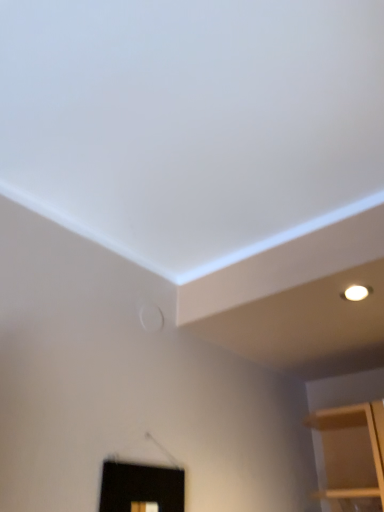
What do you see at coordinates (141, 488) in the screenshot?
I see `black matte cabinet at lower left` at bounding box center [141, 488].

In order to face black matte cabinet at lower left, should I rotate leftwards or rightwards?

Rotate your view left by about 7.078°.

Where is `black matte cabinet at lower left`? black matte cabinet at lower left is located at coordinates (141, 488).

Where is `black matte cabinet at lower left`? Image resolution: width=384 pixels, height=512 pixels. black matte cabinet at lower left is located at coordinates (141, 488).